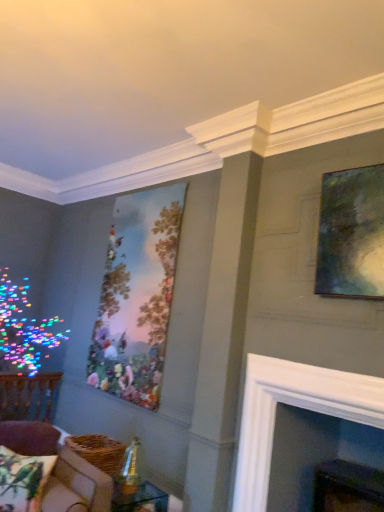
Question: Choose the correct answer: Is white glossy fireplace at center inside printed fabric pillow with parrots at lower left or outside it?

Choices:
 (A) outside
 (B) inside

Answer: (A)

Question: Is white glossy fireplace at center wider or thinner than printed fabric pillow with parrots at lower left?

Choices:
 (A) thin
 (B) wide

Answer: (B)

Question: Which is farther from the white glossy fireplace at center?

Choices:
 (A) printed fabric pillow with parrots at lower left
 (B) velvet brown couch at lower left
 (C) matte canvas painting at center-left, the first picture frame when ordered from left to right
 (D) metallic green painting at upper right, which is the first picture frame in right-to-left order
 (E) clear glass table at lower center

Answer: (C)

Question: Which object is the closest to the clear glass table at lower center?

Choices:
 (A) velvet brown couch at lower left
 (B) printed fabric pillow with parrots at lower left
 (C) metallic green painting at upper right, marked as the 2th picture frame in a left-to-right arrangement
 (D) white glossy fireplace at center
 (E) matte canvas painting at center-left, positioned as the second picture frame in right-to-left order

Answer: (A)